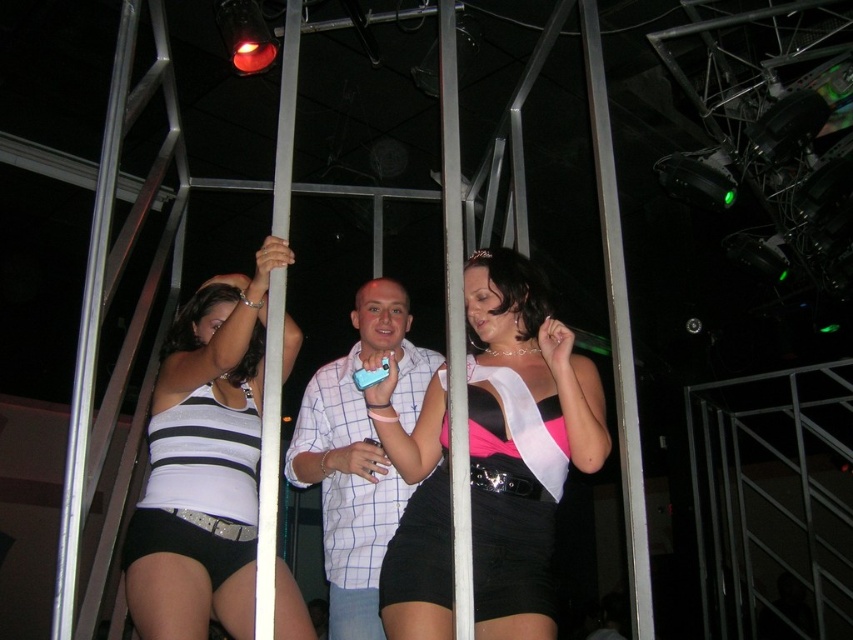
You are a fashion designer observing the nightclub scene. You notice two pairs of black satin shorts in the image. Which pair has a greater width? The options are the black satin shorts at center and the black satin shorts at lower left.

The black satin shorts at center has a greater width than the black satin shorts at lower left.

Consider the image. You are a photographer at the nightclub scene. You need to position yourself so that both the black satin shorts at center and the black satin shorts at lower left are visible in your shot. Based on their positions, which direction should you move to ensure both are in frame?

You should move to the left to ensure both the black satin shorts at center and the black satin shorts at lower left are visible in your shot. Since the black satin shorts at center are to the right of the black satin shorts at lower left, moving left will allow you to capture both in the frame.